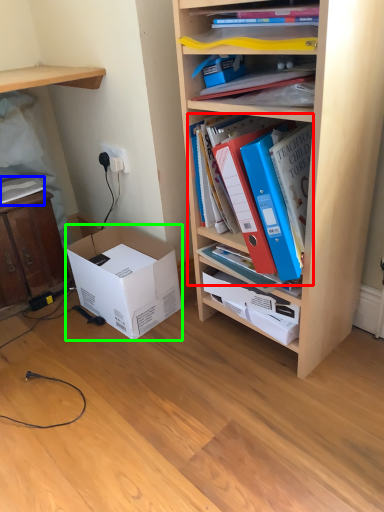
Question: Which is nearer to the book (highlighted by a red box)? book (highlighted by a blue box) or box (highlighted by a green box).

Choices:
 (A) book
 (B) box

Answer: (B)